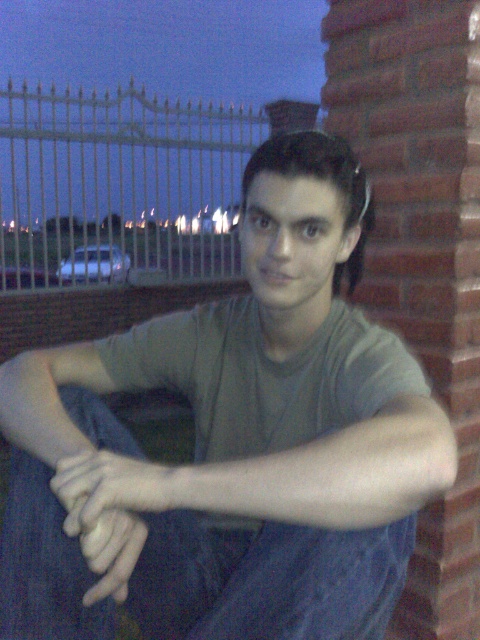
Question: Does denim at left come behind smooth skin hand at center?

Choices:
 (A) no
 (B) yes

Answer: (B)

Question: Which point is closer to the camera taking this photo?

Choices:
 (A) (137, 554)
 (B) (312, 193)
 (C) (88, 509)
 (D) (92, 260)

Answer: (C)

Question: Does matte gray t-shirt at center lie behind smooth skin hand at center?

Choices:
 (A) no
 (B) yes

Answer: (A)

Question: Can you confirm if white metal fence at upper left is wider than smooth skin hand at center?

Choices:
 (A) yes
 (B) no

Answer: (A)

Question: Estimate the real-world distances between objects in this image. Which object is closer to the gray matte arm at center?

Choices:
 (A) matte gray t-shirt at center
 (B) denim at left
 (C) white metal fence at upper left
 (D) smooth skin hand at center

Answer: (A)

Question: Estimate the real-world distances between objects in this image. Which object is farther from the white metal fence at upper left?

Choices:
 (A) gray matte arm at center
 (B) smooth skin hand at center
 (C) denim at left
 (D) matte gray t-shirt at center

Answer: (B)